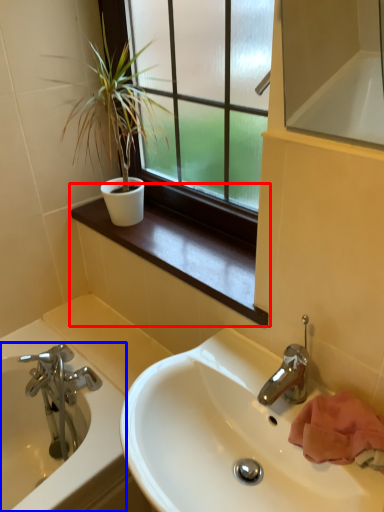
Question: Which object is closer to the camera taking this photo, window sill (highlighted by a red box) or bathtub (highlighted by a blue box)?

Choices:
 (A) window sill
 (B) bathtub

Answer: (A)